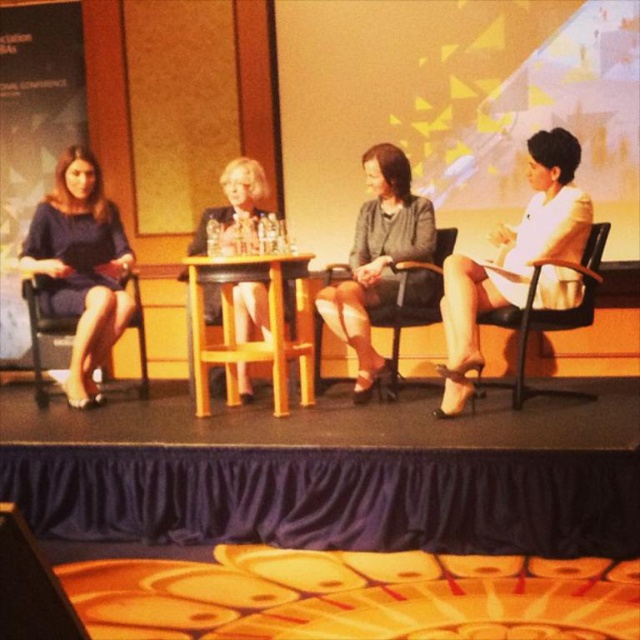
Question: Does wooden table at center appear on the left side of black leather chair at center?

Choices:
 (A) yes
 (B) no

Answer: (A)

Question: Which point is farther to the camera?

Choices:
 (A) white satin dress at right
 (B) wooden table at center

Answer: (B)

Question: Which point is farther to the camera?

Choices:
 (A) wooden table at center
 (B) white satin dress at right
 (C) matte black dress at center

Answer: (C)

Question: Does matte black dress at center appear on the left side of wooden chair at left?

Choices:
 (A) no
 (B) yes

Answer: (A)

Question: Observing the image, what is the correct spatial positioning of wooden table at center in reference to wooden chair at left?

Choices:
 (A) below
 (B) above

Answer: (B)

Question: Which object is the closest to the black leather chair at right?

Choices:
 (A) wooden chair at left
 (B) black leather chair at center
 (C) matte black dress at center
 (D) white satin dress at right

Answer: (D)